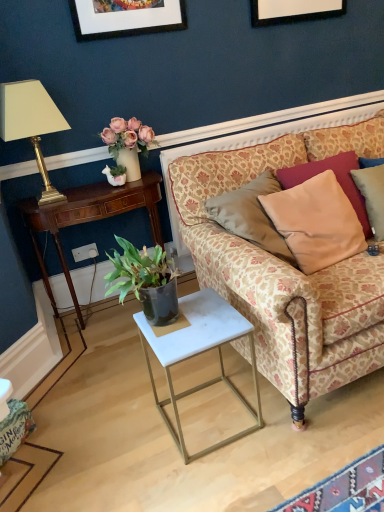
The height and width of the screenshot is (512, 384). Identify the location of free space in front of white marble table at lower center. (225, 482).